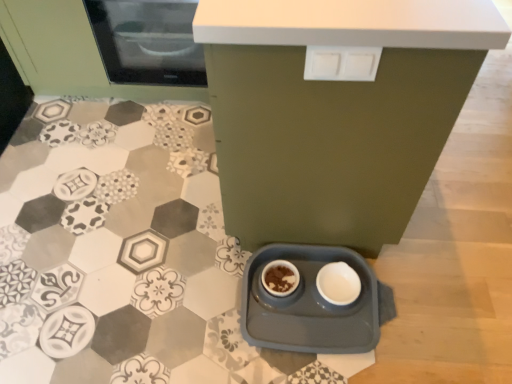
Question: Is matte ceramic bowl at center thinner than matte green cabinet at lower center?

Choices:
 (A) no
 (B) yes

Answer: (B)

Question: From the image's perspective, would you say matte ceramic bowl at center is positioned over matte green cabinet at lower center?

Choices:
 (A) yes
 (B) no

Answer: (B)

Question: Does matte ceramic bowl at center come behind matte green cabinet at lower center?

Choices:
 (A) no
 (B) yes

Answer: (B)

Question: From a real-world perspective, does matte ceramic bowl at center stand above matte green cabinet at lower center?

Choices:
 (A) no
 (B) yes

Answer: (A)

Question: Can matte green cabinet at lower center be found inside matte ceramic bowl at center?

Choices:
 (A) no
 (B) yes

Answer: (A)

Question: Is the position of matte ceramic bowl at center less distant than that of matte green cabinet at lower center?

Choices:
 (A) no
 (B) yes

Answer: (A)

Question: Does gray plastic tray at lower center lie behind matte ceramic bowl at center?

Choices:
 (A) yes
 (B) no

Answer: (B)

Question: From a real-world perspective, is gray plastic tray at lower center over matte ceramic bowl at center?

Choices:
 (A) yes
 (B) no

Answer: (B)

Question: Does gray plastic tray at lower center have a greater height compared to matte ceramic bowl at center?

Choices:
 (A) no
 (B) yes

Answer: (B)

Question: From the image's perspective, would you say gray plastic tray at lower center is shown under matte ceramic bowl at center?

Choices:
 (A) yes
 (B) no

Answer: (A)

Question: Does gray plastic tray at lower center appear on the right side of matte ceramic bowl at center?

Choices:
 (A) yes
 (B) no

Answer: (A)

Question: Can you confirm if gray plastic tray at lower center is wider than matte ceramic bowl at center?

Choices:
 (A) yes
 (B) no

Answer: (A)

Question: Is matte black microwave at upper left to the right of white glossy bowl at lower center from the viewer's perspective?

Choices:
 (A) no
 (B) yes

Answer: (A)